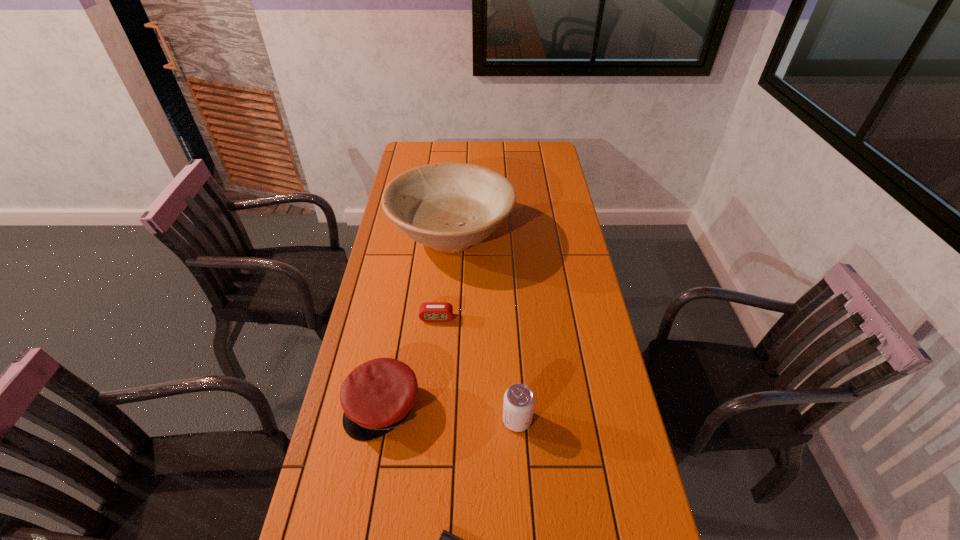
The image size is (960, 540). Find the location of `dish`. dish is located at coordinates (449, 206).

Find the location of a particular element. the farthest object is located at coordinates (449, 206).

Identify the location of the fourth shortest object. (519, 400).

Locate an element on the screen. the third shortest object is located at coordinates (377, 396).

The image size is (960, 540). I want to click on alarm clock, so (x=429, y=311).

You are a GUI agent. You are given a task and a screenshot of the screen. Output one action in this format:
    pyautogui.click(x=<x>, y=<y>)
    Task: Click on the second shortest object
    
    Given the screenshot: What is the action you would take?
    pyautogui.click(x=429, y=311)

Image resolution: width=960 pixels, height=540 pixels. I want to click on vacant space located 0.120m on the front of the farthest object, so click(446, 305).

Identify the location of free space located 0.100m on the left of the fourth shortest object. This screenshot has width=960, height=540. (465, 420).

This screenshot has width=960, height=540. I want to click on free space located 0.220m at the front of the cap where the visor is located, so click(360, 537).

Where is `vacant space situated 0.320m on the front-facing side of the fourth nearest object`? The width and height of the screenshot is (960, 540). vacant space situated 0.320m on the front-facing side of the fourth nearest object is located at coordinates (427, 414).